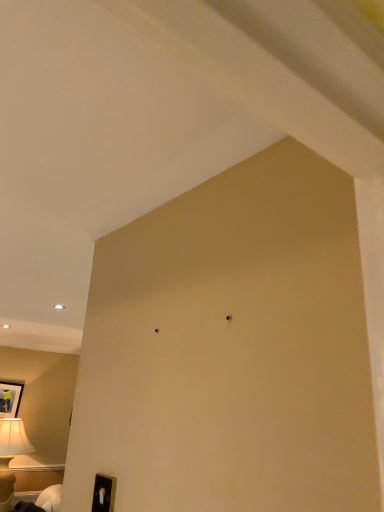
Question: Is matte black picture frame at lower left to the left of white glossy lampshade at lower left from the viewer's perspective?

Choices:
 (A) yes
 (B) no

Answer: (A)

Question: Does matte black picture frame at lower left appear on the right side of white glossy lampshade at lower left?

Choices:
 (A) yes
 (B) no

Answer: (B)

Question: Would you consider matte black picture frame at lower left to be distant from white glossy lampshade at lower left?

Choices:
 (A) yes
 (B) no

Answer: (A)

Question: Does matte black picture frame at lower left have a lesser height compared to white glossy lampshade at lower left?

Choices:
 (A) no
 (B) yes

Answer: (A)

Question: Is matte black picture frame at lower left facing towards white glossy lampshade at lower left?

Choices:
 (A) yes
 (B) no

Answer: (B)

Question: Can you confirm if matte black picture frame at lower left is taller than white glossy lampshade at lower left?

Choices:
 (A) no
 (B) yes

Answer: (B)

Question: Can you confirm if white glossy lampshade at lower left is shorter than matte black picture frame at lower left?

Choices:
 (A) no
 (B) yes

Answer: (B)

Question: From the image's perspective, is white glossy lampshade at lower left below matte black picture frame at lower left?

Choices:
 (A) no
 (B) yes

Answer: (B)

Question: From a real-world perspective, is white glossy lampshade at lower left beneath matte black picture frame at lower left?

Choices:
 (A) no
 (B) yes

Answer: (B)

Question: Does white glossy lampshade at lower left have a smaller size compared to matte black picture frame at lower left?

Choices:
 (A) yes
 (B) no

Answer: (B)

Question: Is white glossy lampshade at lower left thinner than matte black picture frame at lower left?

Choices:
 (A) no
 (B) yes

Answer: (A)

Question: Could you tell me if white glossy lampshade at lower left is turned towards matte black picture frame at lower left?

Choices:
 (A) yes
 (B) no

Answer: (B)

Question: Would you say matte black picture frame at lower left is to the left or to the right of white glossy lampshade at lower left in the picture?

Choices:
 (A) right
 (B) left

Answer: (B)